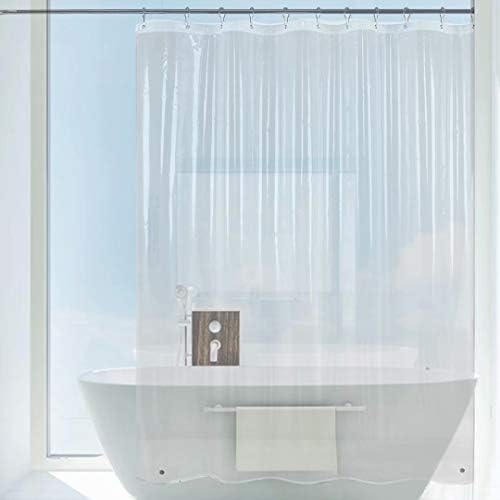
Where is `trim`? Image resolution: width=500 pixels, height=500 pixels. trim is located at coordinates (495, 276).